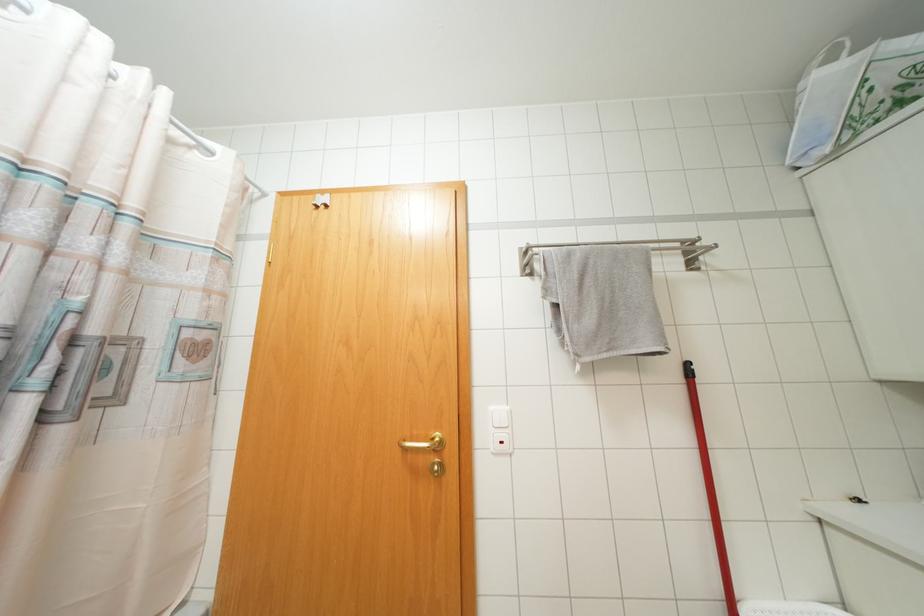
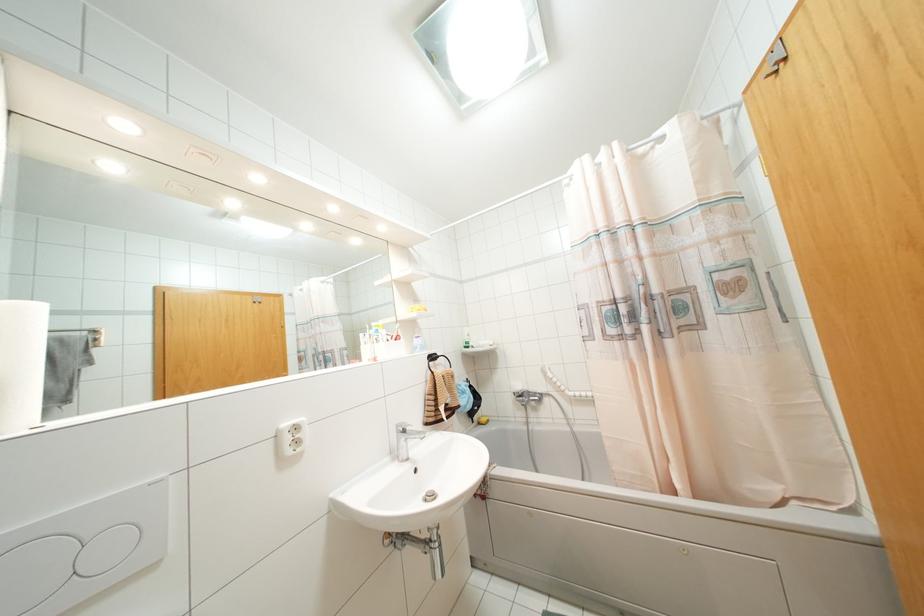
In the second image, find the point that corresponds to (x=317, y=207) in the first image.

(775, 71)